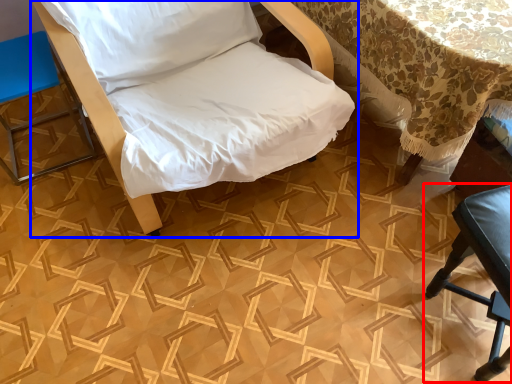
Question: Which point is closer to the camera, furniture (highlighted by a red box) or furniture (highlighted by a blue box)?

Choices:
 (A) furniture
 (B) furniture

Answer: (B)